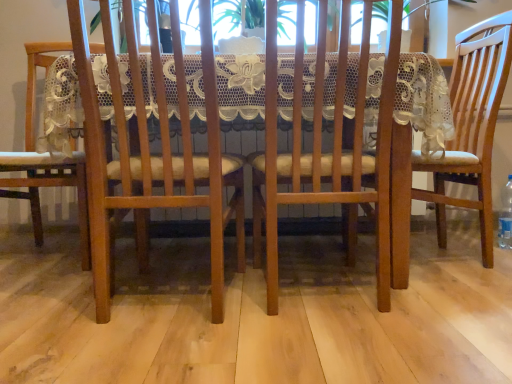
Find the location of a particular element. This screenshot has height=384, width=512. vacant space in front of wooden chair at center, which ranks as the second chair in right-to-left order is located at coordinates (362, 345).